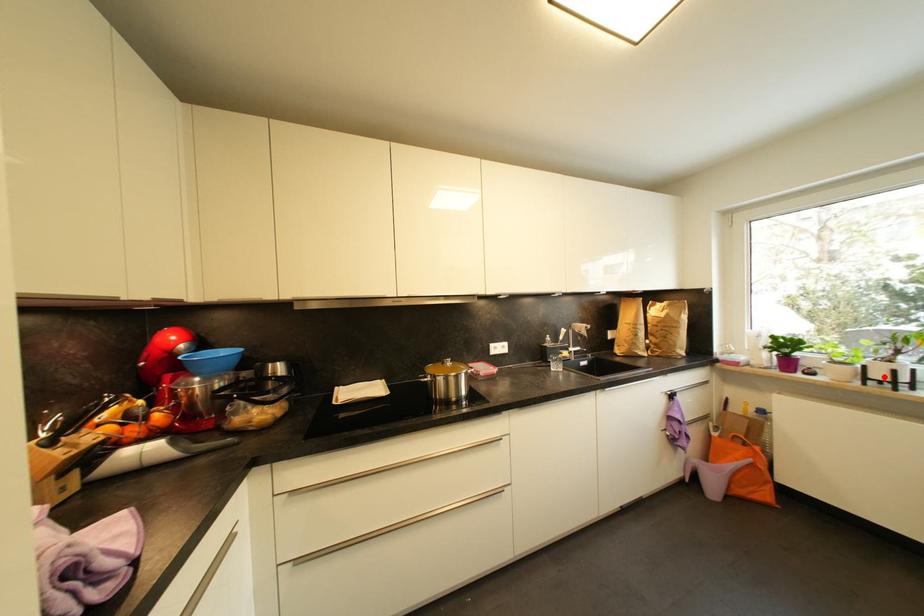
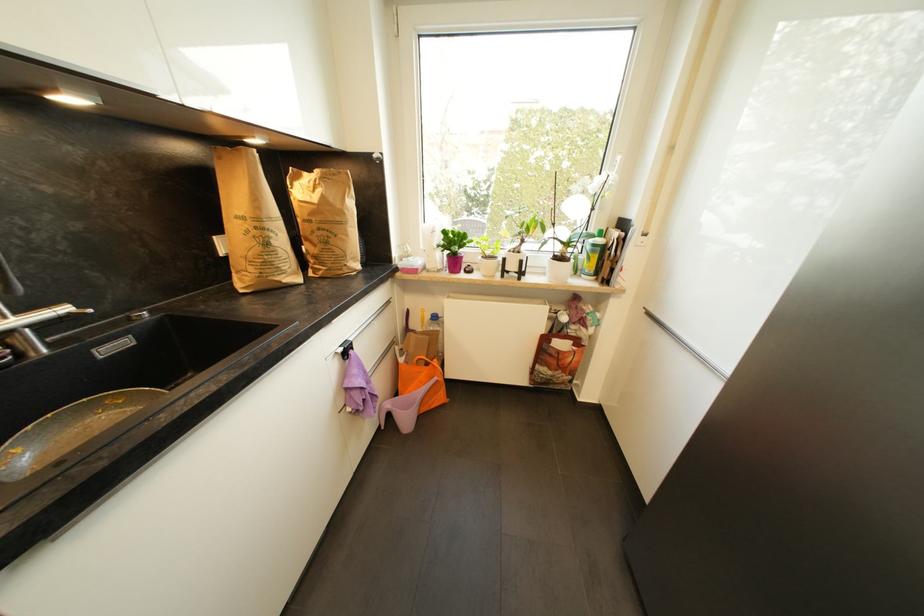
Find the pixel in the second image that matches the highlighted location in the first image.

(517, 268)